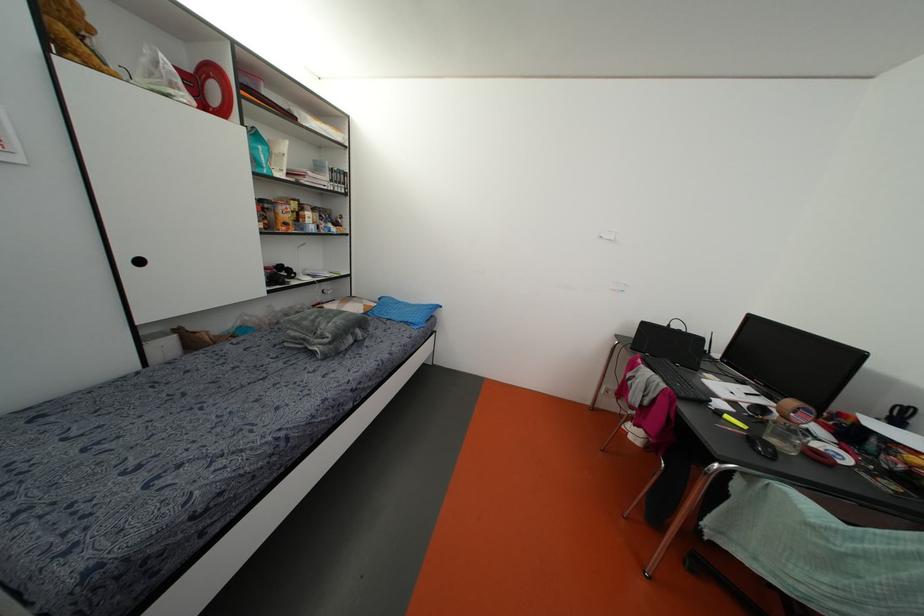
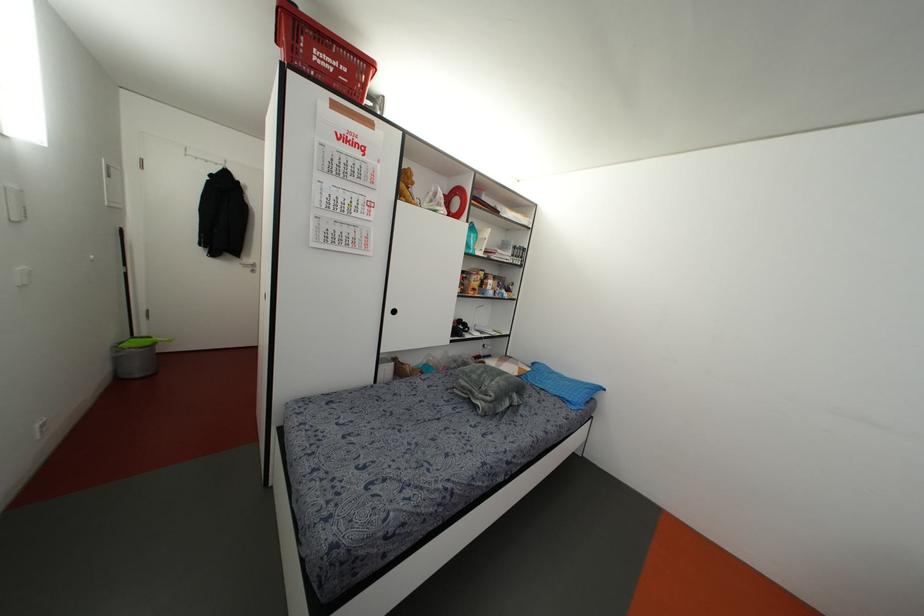
Find the pixel in the second image that matches point (203, 106) in the first image.

(448, 213)